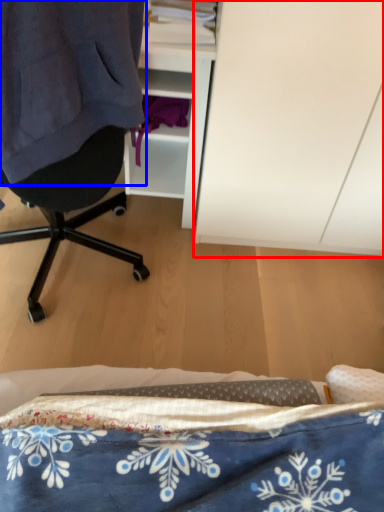
Question: Among these objects, which one is farthest to the camera, cabinetry (highlighted by a red box) or clothing (highlighted by a blue box)?

Choices:
 (A) cabinetry
 (B) clothing

Answer: (A)